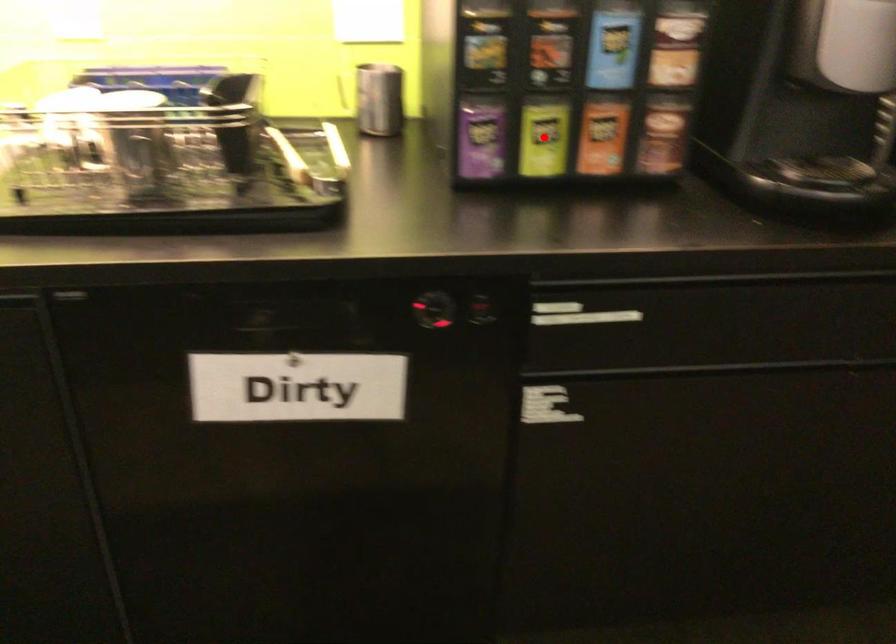
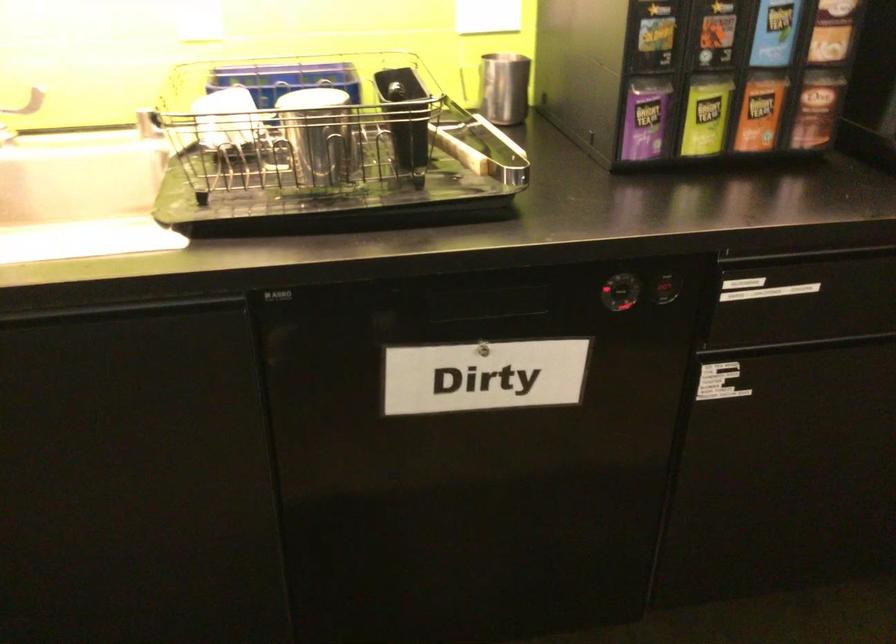
Where in the second image is the point corresponding to the highlighted location from the first image?

(705, 116)